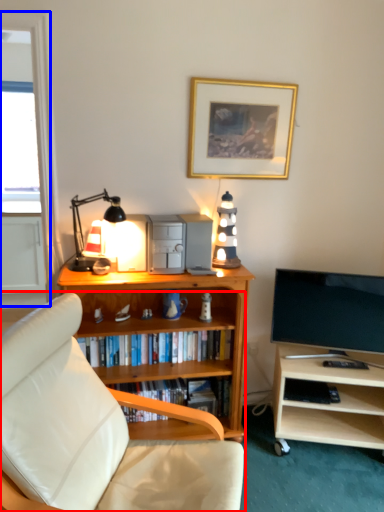
Question: Which object appears farthest to the camera in this image, studio couch (highlighted by a red box) or glass door (highlighted by a blue box)?

Choices:
 (A) studio couch
 (B) glass door

Answer: (B)